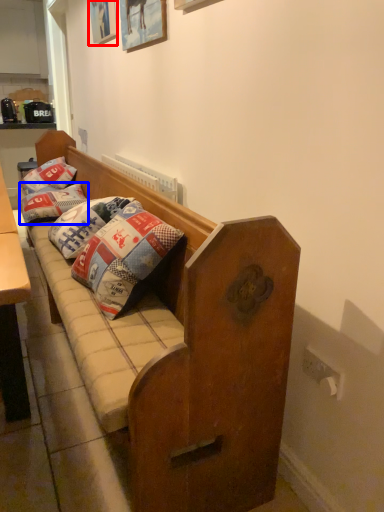
Question: Which of the following is the closest to the observer, picture frame (highlighted by a red box) or pillow (highlighted by a blue box)?

Choices:
 (A) picture frame
 (B) pillow

Answer: (A)